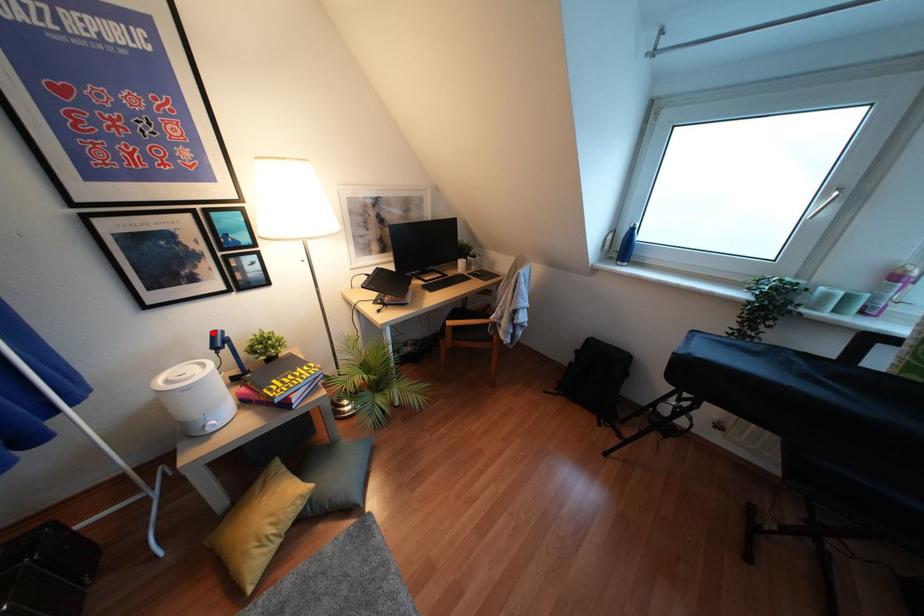
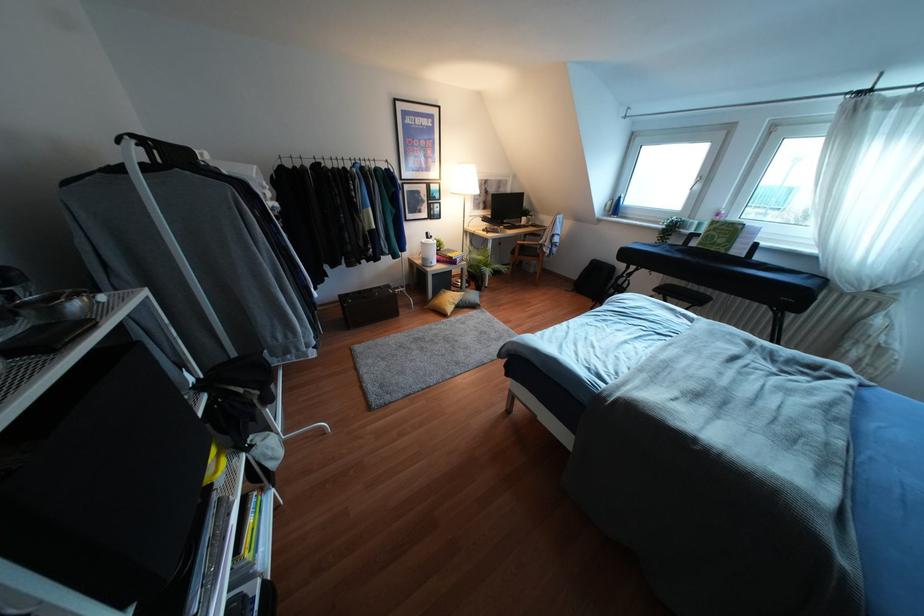
In the second image, find the point that corresponds to the highlighted location in the first image.

(427, 233)